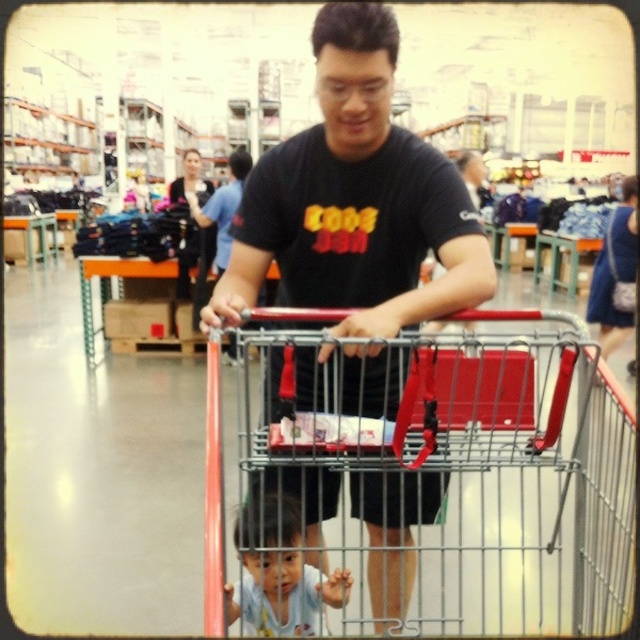
Which is below, metallic silver shopping cart at center or light blue fabric baby at lower center?

Positioned lower is light blue fabric baby at lower center.

Is point (472, 445) more distant than point (256, 593)?

No, it is not.

This screenshot has width=640, height=640. What are the coordinates of `metallic silver shopping cart at center` in the screenshot? It's located at (424, 476).

Is point (442, 406) closer to camera compared to point (388, 209)?

That is True.

Does metallic silver shopping cart at center appear under black matte t-shirt at center?

Correct, metallic silver shopping cart at center is located below black matte t-shirt at center.

Does point (554, 548) come in front of point (312, 44)?

Yes, point (554, 548) is in front of point (312, 44).

This screenshot has height=640, width=640. What are the coordinates of `metallic silver shopping cart at center` in the screenshot? It's located at (424, 476).

Which is more to the left, black matte t-shirt at center or light blue fabric baby at lower center?

light blue fabric baby at lower center is more to the left.

Is black matte t-shirt at center taller than light blue fabric baby at lower center?

Yes, black matte t-shirt at center is taller than light blue fabric baby at lower center.

Which is in front, point (397, 596) or point (296, 570)?

Positioned in front is point (296, 570).

Where is `black matte t-shirt at center`? Image resolution: width=640 pixels, height=640 pixels. black matte t-shirt at center is located at coordinates (355, 202).